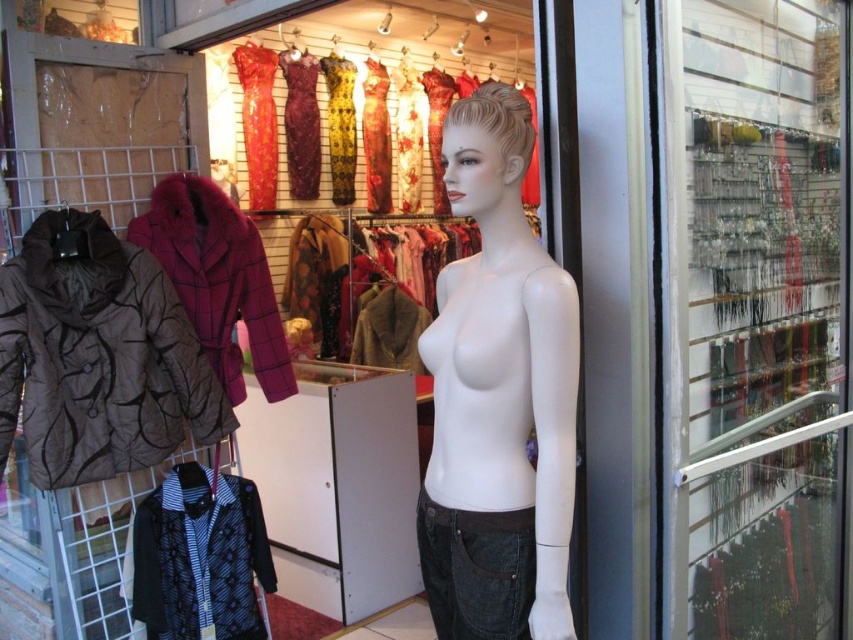
You are a delivery person who needs to place a new shiny orange dress at upper center into the display window. The delivery box is 1.2 meters wide. Can the box fit through the space between the white matte mannequin at center and the rack on the left?

The white matte mannequin at center might be wider than the shiny orange dress at upper center, so the space between them may not be wide enough for the delivery box that is 1.2 meters wide. It is recommended to check the actual width before attempting to move the box through.

You are a delivery person standing in front of the clothing store display window. You need to place a package on the ground near the white matte mannequin at center. The package is 1.3 meters long. Can you fit the package horizontally next to the mannequin without it extending beyond the display window?

The white matte mannequin at center is 1.29 meters away from the camera. Since the package is 1.3 meters long, it would extend beyond the display window if placed horizontally next to the mannequin.

You are standing in front of the clothing store window. You want to locate the brown quilted jacket at left. Where exactly is it positioned in the window?

The brown quilted jacket at left is positioned at point (x=97, y=356) in the window.